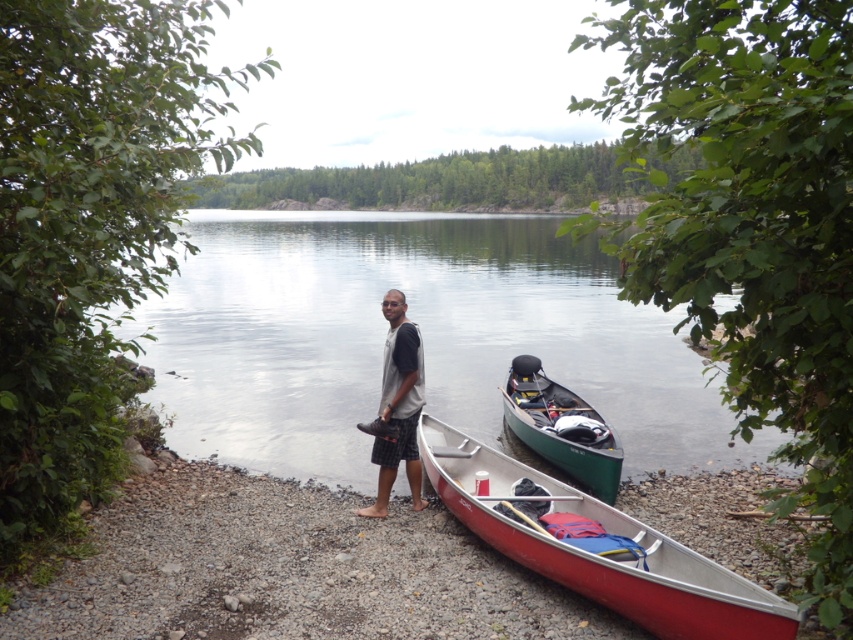
Question: Which object is the farthest from the gray fabric shirt at center?

Choices:
 (A) smooth water at center
 (B) green matte canoe at center
 (C) red aluminum canoe at lower center

Answer: (A)

Question: Which of the following is the closest to the observer?

Choices:
 (A) smooth water at center
 (B) green matte canoe at center

Answer: (B)

Question: Is smooth water at center bigger than green matte canoe at center?

Choices:
 (A) yes
 (B) no

Answer: (A)

Question: Observing the image, what is the correct spatial positioning of red aluminum canoe at lower center in reference to gray fabric shirt at center?

Choices:
 (A) right
 (B) left

Answer: (A)

Question: Is smooth water at center positioned at the back of red aluminum canoe at lower center?

Choices:
 (A) yes
 (B) no

Answer: (A)

Question: Which point is closer to the camera taking this photo?

Choices:
 (A) (595, 561)
 (B) (389, 330)
 (C) (561, 312)
 (D) (585, 467)

Answer: (A)